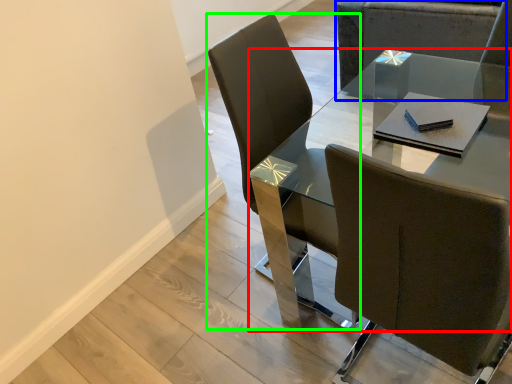
Question: Which object is positioned closest to table (highlighted by a red box)? Select from chair (highlighted by a blue box) and chair (highlighted by a green box).

Choices:
 (A) chair
 (B) chair

Answer: (A)